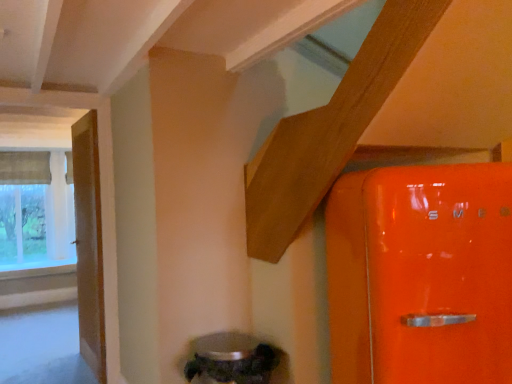
Question: Is textured fabric window at left inside or outside of wooden door at left?

Choices:
 (A) outside
 (B) inside

Answer: (A)

Question: In terms of width, does textured fabric window at left look wider or thinner when compared to wooden door at left?

Choices:
 (A) thin
 (B) wide

Answer: (B)

Question: Considering the real-world distances, which object is closest to the clear glass window sill at lower left?

Choices:
 (A) metallic silver water heater at lower center
 (B) wooden door at left
 (C) textured fabric window at left

Answer: (C)

Question: Considering the real-world distances, which object is farthest from the metallic silver water heater at lower center?

Choices:
 (A) wooden door at left
 (B) textured fabric window at left
 (C) clear glass window sill at lower left

Answer: (B)